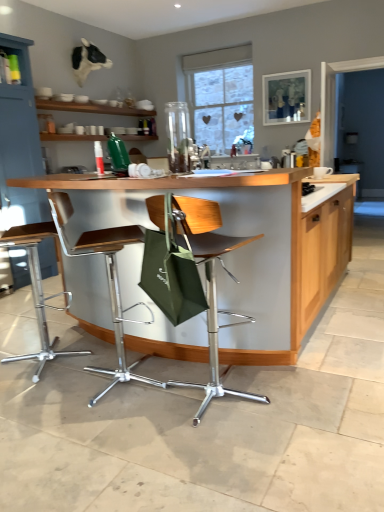
You are a GUI agent. You are given a task and a screenshot of the screen. Output one action in this format:
    pyautogui.click(x=<x>, y=<y>)
    Task: Click on the vacant area in front of brown leather chair at center, which is counted as the 1th chair, starting from the right
    This screenshot has height=512, width=384.
    Given the screenshot: What is the action you would take?
    pyautogui.click(x=217, y=454)